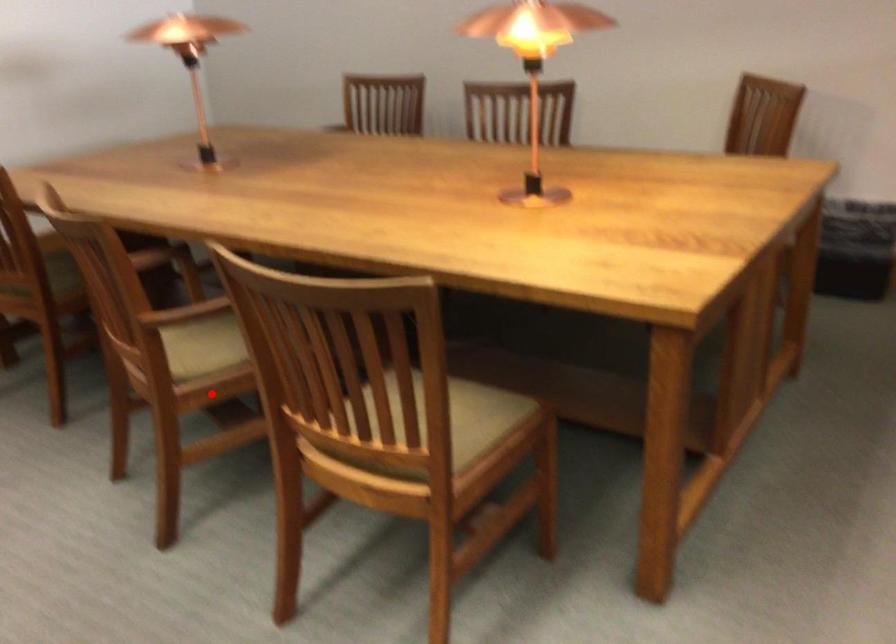
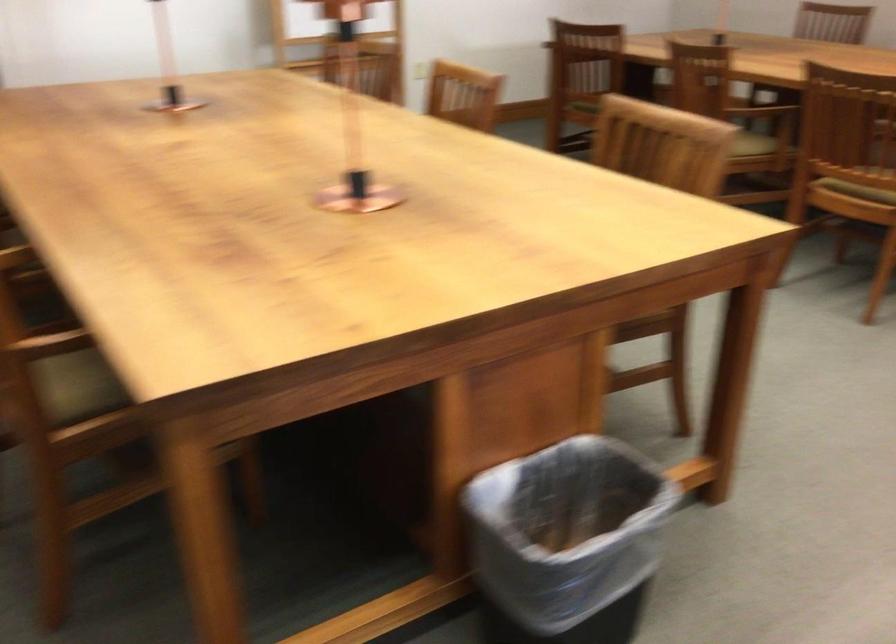
Question: I am providing you with two images of the same scene from different viewpoints. Given a red point in image1, look at the same physical point in image2. Is it:

Choices:
 (A) Closer to the viewpoint
 (B) Farther from the viewpoint

Answer: (B)